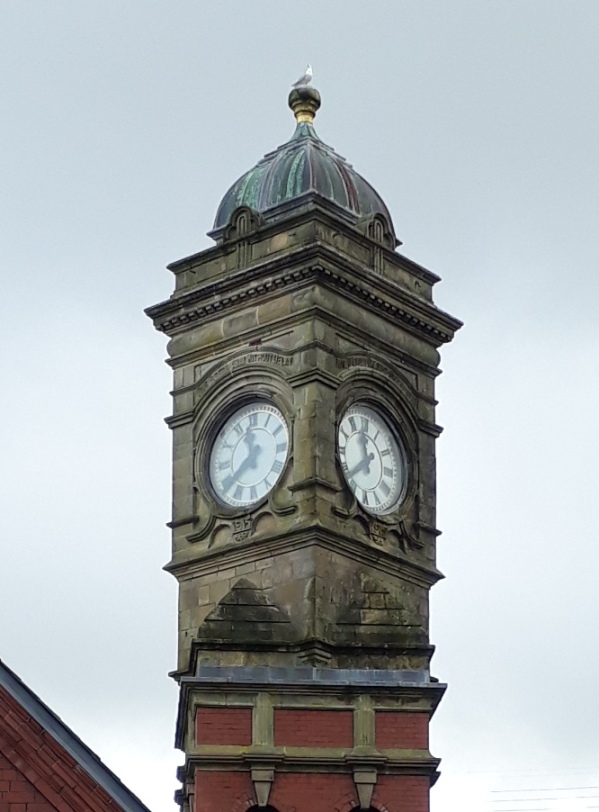
You are a GUI agent. You are given a task and a screenshot of the screen. Output one action in this format:
    pyautogui.click(x=<x>, y=<y>)
    Task: Click on the windows
    Image resolution: width=599 pixels, height=812 pixels.
    Given the screenshot: What is the action you would take?
    pyautogui.click(x=269, y=806), pyautogui.click(x=360, y=809)